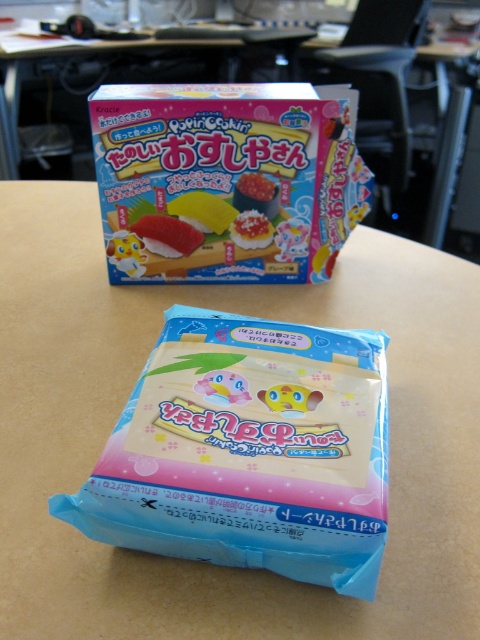
You are organizing items on a table and need to move the item at point (355,432) to a new location. However, there is another item at point (192,244). Can you move the first item directly to the back of the second item without moving the second item?

Yes, because point (355,432) is already in front of point (192,244), so moving it to the back would place it behind the second item without needing to move the second item.